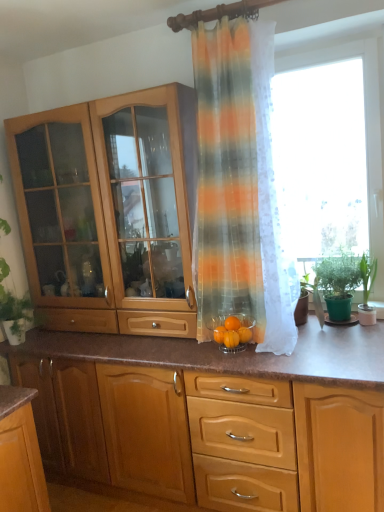
Locate an element on the screen. The height and width of the screenshot is (512, 384). free space above transparent fabric at right (from a real-world perspective) is located at coordinates (325, 44).